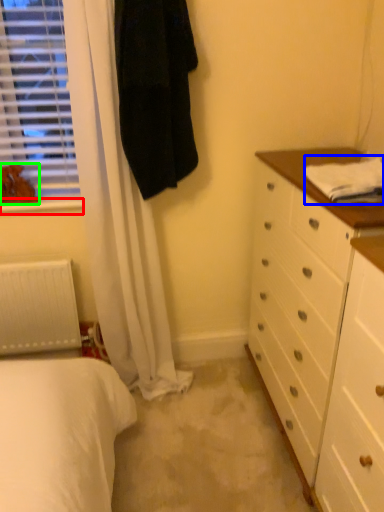
Question: Considering the real-world distances, which object is farthest from window sill (highlighted by a red box)? sheet (highlighted by a blue box) or animal (highlighted by a green box)?

Choices:
 (A) sheet
 (B) animal

Answer: (A)